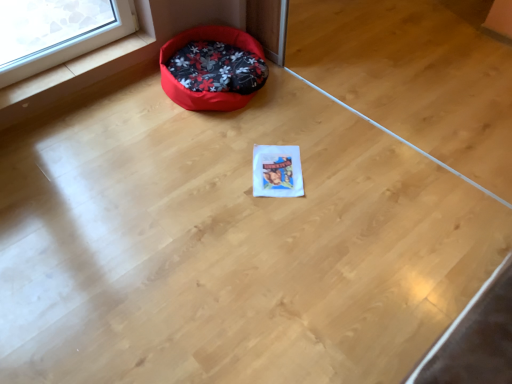
Locate an element on the screen. This screenshot has height=384, width=512. blank space to the left of floral fabric dog bed at upper left is located at coordinates (123, 109).